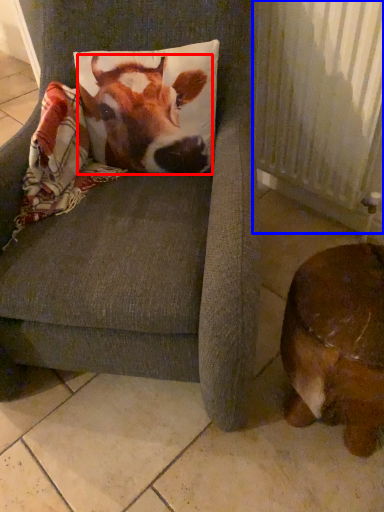
Question: Which object is further to the camera taking this photo, cattle (highlighted by a red box) or radiator (highlighted by a blue box)?

Choices:
 (A) cattle
 (B) radiator

Answer: (B)